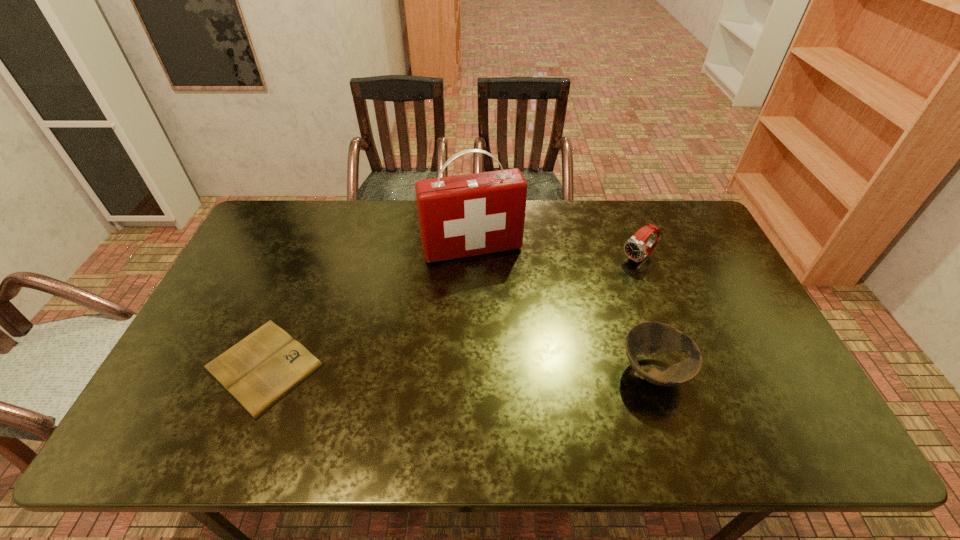
Find the location of a particular element. Image resolution: width=960 pixels, height=540 pixels. vacant region at the near edge of the desktop is located at coordinates (395, 398).

In the image, there is a desktop. Where is `free space at the left edge`? The height and width of the screenshot is (540, 960). free space at the left edge is located at coordinates (194, 376).

The height and width of the screenshot is (540, 960). In the image, there is a desktop. What are the coordinates of `blank space at the right edge` in the screenshot? It's located at (735, 308).

The height and width of the screenshot is (540, 960). Find the location of `free spot between the second tallest object and the leftmost object`. free spot between the second tallest object and the leftmost object is located at coordinates (451, 312).

Where is `vacant area that lies between the second shortest object and the book`? Image resolution: width=960 pixels, height=540 pixels. vacant area that lies between the second shortest object and the book is located at coordinates pyautogui.click(x=459, y=368).

The height and width of the screenshot is (540, 960). Find the location of `empty space that is in between the third object from right to left and the shortest object`. empty space that is in between the third object from right to left and the shortest object is located at coordinates pos(368,307).

Locate an element on the screen. The image size is (960, 540). blank region between the second tallest object and the leftmost object is located at coordinates (x=451, y=312).

I want to click on unoccupied position between the second shortest object and the book, so click(459, 368).

You are a GUI agent. You are given a task and a screenshot of the screen. Output one action in this format:
    pyautogui.click(x=<x>, y=<y>)
    Task: Click on the vacant area that lies between the leftmost object and the first-aid kit
    
    Given the screenshot: What is the action you would take?
    pyautogui.click(x=368, y=307)

Find the location of a particular element. This screenshot has width=960, height=540. free area in between the second tallest object and the third tallest object is located at coordinates (646, 315).